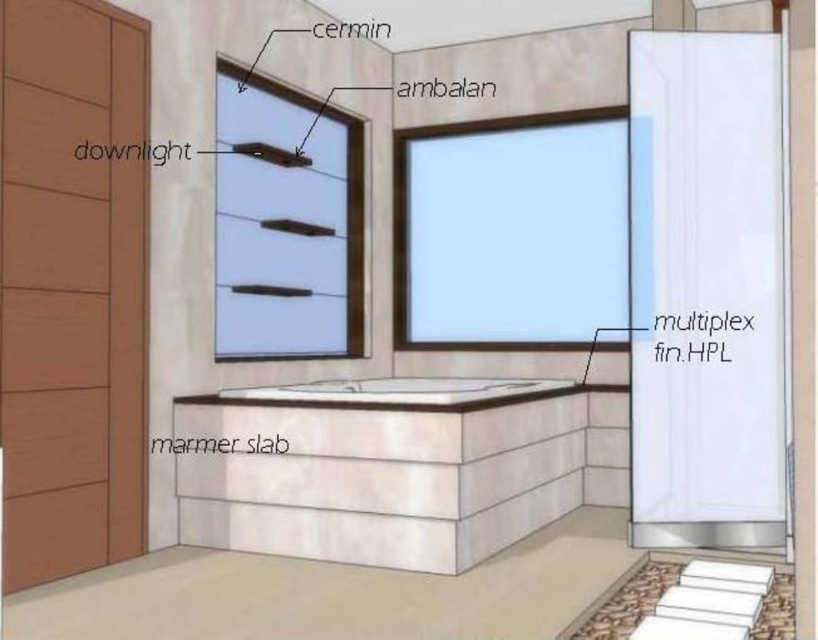
Is point (583, 147) less distant than point (324, 230)?

No, it is not.

Between transparent glass window at center and transparent glass window at upper center, which one is positioned lower?

transparent glass window at center is lower down.

Is point (439, 188) positioned after point (221, 237)?

Yes.

Image resolution: width=818 pixels, height=640 pixels. What are the coordinates of `transparent glass window at center` in the screenshot? It's located at (511, 228).

In the scene shown: Which is more to the right, transparent glass window at upper center or white marble bath at center?

white marble bath at center is more to the right.

Which is in front, point (264, 202) or point (367, 396)?

Point (367, 396) is more forward.

Locate an element on the screen. The height and width of the screenshot is (640, 818). transparent glass window at upper center is located at coordinates (286, 224).

Which is behind, point (407, 316) or point (529, 381)?

Positioned behind is point (407, 316).

Between transparent glass window at center and white marble bath at center, which one appears on the right side from the viewer's perspective?

Positioned to the right is transparent glass window at center.

Between point (421, 326) and point (389, 401), which one is positioned in front?

Point (389, 401) is in front.

Locate an element on the screen. The width and height of the screenshot is (818, 640). transparent glass window at center is located at coordinates (511, 228).